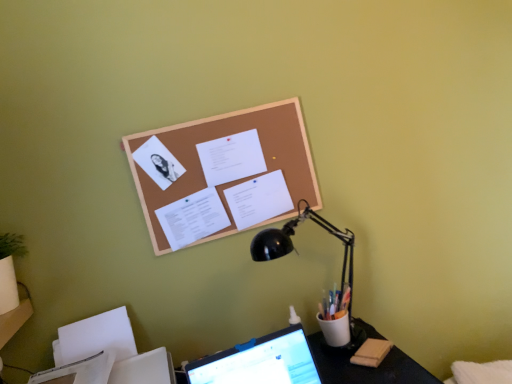
Question: Considering the relative positions of white paper at center, positioned as the second document in bottom-to-top order, and white paper at center, which is the 3th document in bottom-to-top order, in the image provided, is white paper at center, positioned as the second document in bottom-to-top order, to the left or to the right of white paper at center, which is the 3th document in bottom-to-top order,?

Choices:
 (A) right
 (B) left

Answer: (A)

Question: From a real-world perspective, is white paper at center, positioned as the second document in bottom-to-top order, physically located above or below white paper at center, which is the 3th document in bottom-to-top order?

Choices:
 (A) below
 (B) above

Answer: (A)

Question: Which is nearer to the black metal lamp at upper right?

Choices:
 (A) white paper at center, arranged as the 1th document when viewed from the top
 (B) corkboard at upper center
 (C) white paper at center, positioned as the second document in bottom-to-top order
 (D) black plastic desk at lower center
 (E) white paper at center, which ranks as the third document in top-to-bottom order

Answer: (C)

Question: Considering the real-world distances, which object is closest to the black plastic desk at lower center?

Choices:
 (A) white paper at center, which is the 3th document in bottom-to-top order
 (B) black metal lamp at upper right
 (C) corkboard at upper center
 (D) white paper at center, which ranks as the third document in top-to-bottom order
 (E) white paper at center, marked as the 2th document in a top-to-bottom arrangement

Answer: (B)